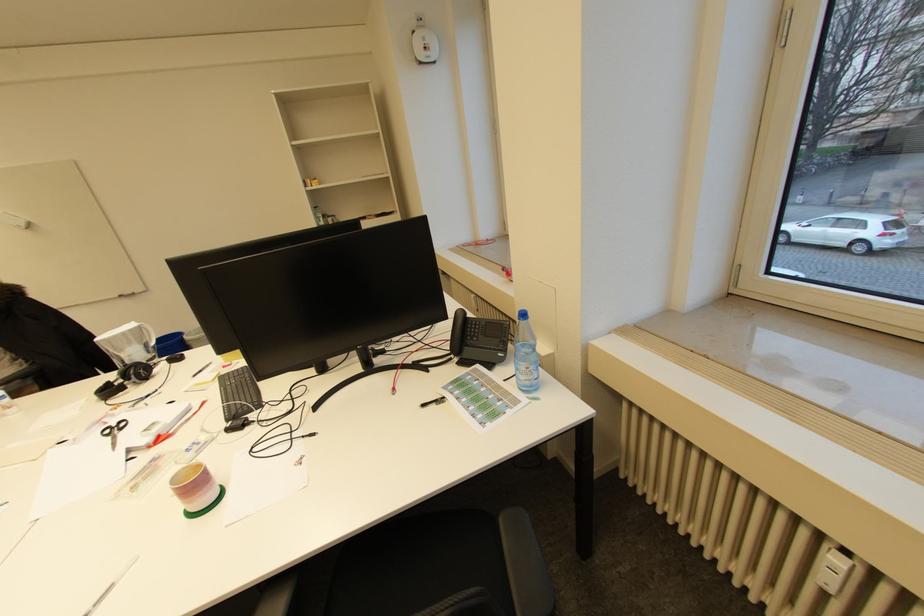
Where would you pull the white pitcher handle? Please return your answer as a coordinate pair (x, y).

(129, 345)